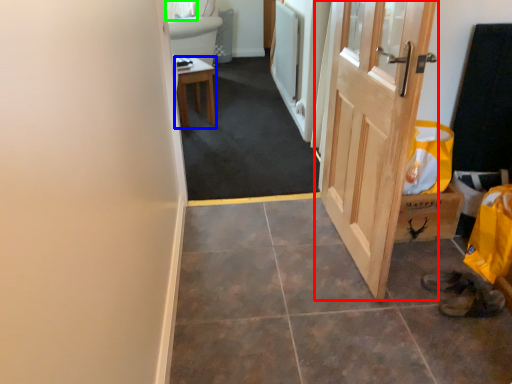
Question: Estimate the real-world distances between objects in this image. Which object is farther from door (highlighted by a red box), furniture (highlighted by a blue box) or curtain (highlighted by a green box)?

Choices:
 (A) furniture
 (B) curtain

Answer: (B)